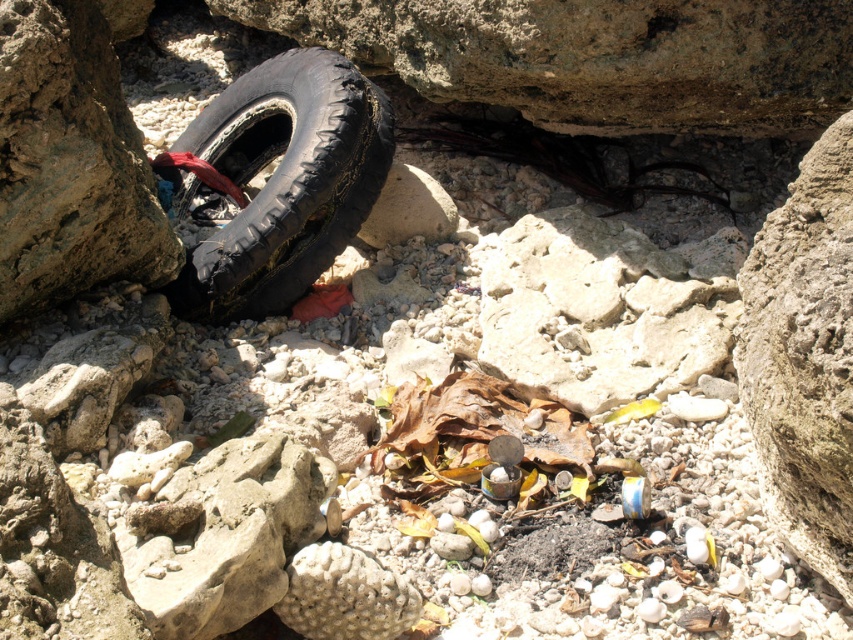
You are standing in the rocky outdoor scene with a large black tire and scattered debris. You see two points marked as point 1 at coordinates (283, 106) and point 2 at coordinates (849, 320). Which point is closer to you?

Point 1 at coordinates (283, 106) is closer to you because it is further to the viewer than point 2 at coordinates (849, 320).

You are a hiker who needs to cross a rocky area. You see a black rubber tire at left and a rough textured rock at center. Which object can you use as a stepping stone to avoid sinking into the pebbles?

The black rubber tire at left has a larger size compared to the rough textured rock at center, so it provides a more stable and larger surface to step on without sinking into the pebbles.

You are a hiker who has just arrived at the scene. You need to place a small first aid kit between the black rubber tire at left and the rough textured rock at center. Based on their positions, where should you place it?

The rough textured rock at center is behind the black rubber tire at left, so you should place the first aid kit in front of the black rubber tire at left and between it and the rock.